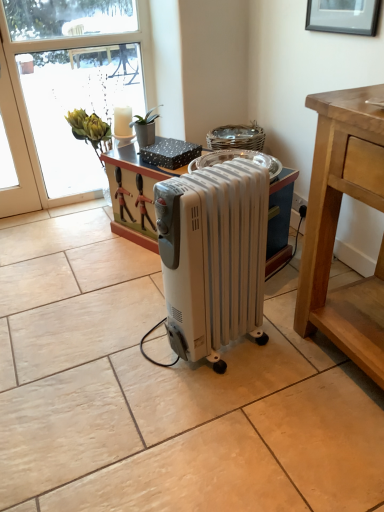
Question: Can you confirm if white plastic radiator at center is positioned to the left of transparent glass window at upper left?

Choices:
 (A) yes
 (B) no

Answer: (B)

Question: Is white plastic radiator at center smaller than transparent glass window at upper left?

Choices:
 (A) yes
 (B) no

Answer: (B)

Question: Is the position of white plastic radiator at center less distant than that of transparent glass window at upper left?

Choices:
 (A) no
 (B) yes

Answer: (B)

Question: From a real-world perspective, is white plastic radiator at center under transparent glass window at upper left?

Choices:
 (A) no
 (B) yes

Answer: (B)

Question: Is white plastic radiator at center surrounding transparent glass window at upper left?

Choices:
 (A) no
 (B) yes

Answer: (A)

Question: Considering the relative sizes of white plastic radiator at center and transparent glass window at upper left in the image provided, is white plastic radiator at center thinner than transparent glass window at upper left?

Choices:
 (A) yes
 (B) no

Answer: (B)

Question: Is white plastic radiator at center positioned behind black matte picture frame at upper center?

Choices:
 (A) no
 (B) yes

Answer: (A)

Question: Can black matte picture frame at upper center be found inside white plastic radiator at center?

Choices:
 (A) no
 (B) yes

Answer: (A)

Question: Does white plastic radiator at center have a greater height compared to black matte picture frame at upper center?

Choices:
 (A) no
 (B) yes

Answer: (B)

Question: Considering the relative positions of white plastic radiator at center and black matte picture frame at upper center in the image provided, is white plastic radiator at center to the left of black matte picture frame at upper center from the viewer's perspective?

Choices:
 (A) no
 (B) yes

Answer: (B)

Question: Does white plastic radiator at center have a greater width compared to black matte picture frame at upper center?

Choices:
 (A) no
 (B) yes

Answer: (B)

Question: Considering the relative sizes of white plastic radiator at center and black matte picture frame at upper center in the image provided, is white plastic radiator at center bigger than black matte picture frame at upper center?

Choices:
 (A) yes
 (B) no

Answer: (A)

Question: Is transparent glass window at upper left turned away from black matte picture frame at upper center?

Choices:
 (A) no
 (B) yes

Answer: (A)